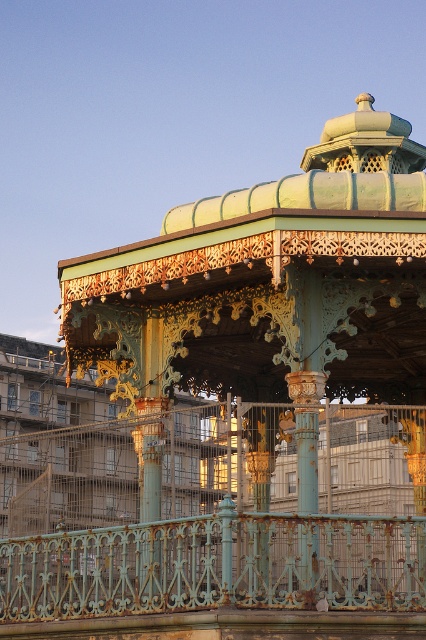
You are a painter who needs to move a ladder from the rusty metal gazebo at center to the rusty metal railing at lower center. The ladder is 3 meters long. Can you move it horizontally without tilting it?

The distance between the rusty metal gazebo at center and the rusty metal railing at lower center is 3.43 meters. Since the ladder is 3 meters long, it is shorter than the distance between them. Therefore, you cannot move it horizontally without tilting it.

You are standing in front of the bandstand and want to determine the relative positions of two points marked on the structure. The first point is at coordinates point (123, 349), and the second is at point (307, 525). Which point is closer to you?

Point (123, 349) is closer to you because it is further to the viewer than point (307, 525).

You are standing at the edge of the promenade and see the rusty metal gazebo at center and the rusty metal railing at lower center. Which object is positioned higher in the scene?

The rusty metal gazebo at center is above the rusty metal railing at lower center, so it is positioned higher in the scene.